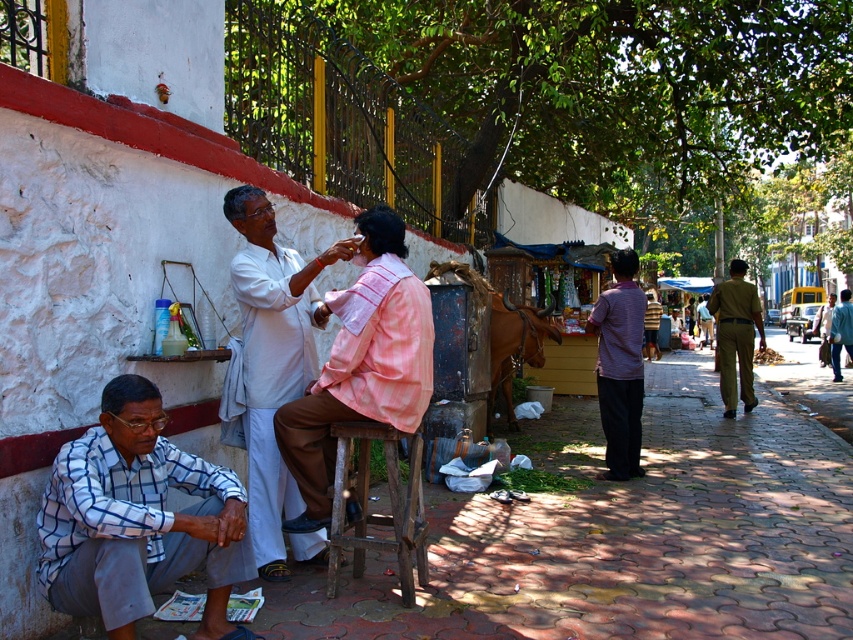
You are a photographer standing in the middle of the street. You see the white cotton kurta at center and the dark green uniform at center. Which one is closer to you?

The white cotton kurta at center is closer to you because it is in front of the dark green uniform at center.

In the street scene, there are two men wearing the white cotton kurta at center and the dark green uniform at center. Which of these two is narrower in width?

The white cotton kurta at center has a lesser width compared to the dark green uniform at center.

You are a tailor standing at the center of the street and you see the purple cotton shirt at center. Can you reach it without moving from your current position?

The purple cotton shirt at center is located at point (619, 365), which is within your reach if you are standing at the center of the street. Therefore, you can reach it without moving.